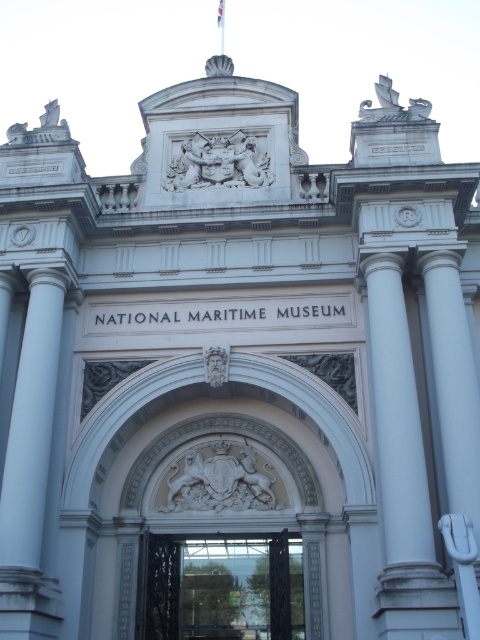
You are standing at the entrance of the National Maritime Museum and want to take a photo of both the white marble column at left and the black wrought iron gate at center. Which object should you focus on first to ensure both are in frame?

You should focus on the white marble column at left first since it is closer to the viewer than the black wrought iron gate at center, allowing you to adjust the camera to include both in the frame.

Looking at this image, you are standing at the entrance of the National Maritime Museum and notice a point marked at coordinates (31, 467). Which object does this point correspond to?

The point at coordinates (31, 467) corresponds to the white marble column at left.

You are standing at the entrance of the National Maritime Museum and see two points marked on the facade. The first point is at coordinates point (38, 598) and the second is at point (160, 627). Which point is closer to your current position?

Point (38, 598) is closer to the camera than point (160, 627), so the first point is closer to your current position.